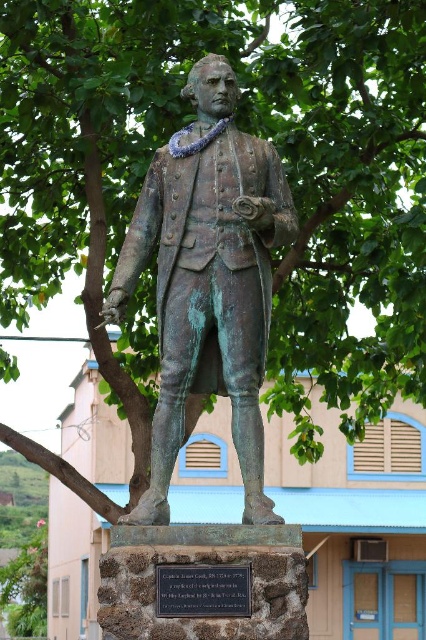
You are standing in front of the statue of Captain James Cook, RN. You notice the green patina statue at center and the black stone plaque at center. Which object is closer to you?

The green patina statue at center is closer to you than the black stone plaque at center.

What is located at the coordinates point (207, 280) in the image?

The green patina statue at center is located at point (207, 280).